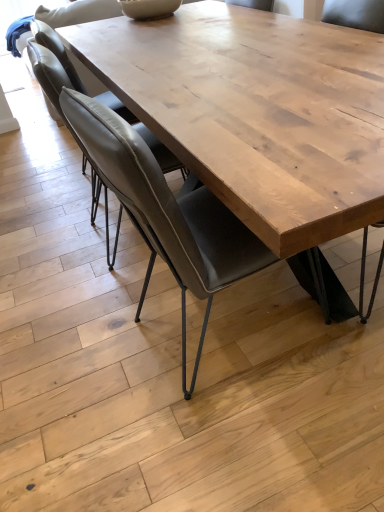
Question: Can you confirm if leather-like gray chair at center, which ranks as the first chair in front-to-back order, is thinner than leather at left, the 2th chair when ordered from front to back?

Choices:
 (A) yes
 (B) no

Answer: (B)

Question: Would you consider leather-like gray chair at center, which ranks as the first chair in front-to-back order, to be distant from leather at left, placed as the first chair when sorted from back to front?

Choices:
 (A) yes
 (B) no

Answer: (B)

Question: Is leather-like gray chair at center, the 2th chair from the back, facing away from leather at left, placed as the first chair when sorted from back to front?

Choices:
 (A) no
 (B) yes

Answer: (A)

Question: Can you confirm if leather-like gray chair at center, which ranks as the first chair in front-to-back order, is shorter than leather at left, placed as the first chair when sorted from back to front?

Choices:
 (A) yes
 (B) no

Answer: (B)

Question: From a real-world perspective, is leather-like gray chair at center, which ranks as the first chair in front-to-back order, physically below leather at left, the 2th chair when ordered from front to back?

Choices:
 (A) yes
 (B) no

Answer: (A)

Question: Is leather at left, the 2th chair when ordered from front to back, completely or partially inside leather-like gray chair at center, the 2th chair from the back?

Choices:
 (A) no
 (B) yes

Answer: (A)

Question: Does leather at left, the 2th chair when ordered from front to back, have a lesser width compared to leather-like gray chair at center, the 2th chair from the back?

Choices:
 (A) yes
 (B) no

Answer: (A)

Question: Is the position of leather at left, the 2th chair when ordered from front to back, more distant than that of leather-like gray chair at center, which ranks as the first chair in front-to-back order?

Choices:
 (A) yes
 (B) no

Answer: (A)

Question: Considering the relative sizes of leather at left, the 2th chair when ordered from front to back, and leather-like gray chair at center, which ranks as the first chair in front-to-back order, in the image provided, is leather at left, the 2th chair when ordered from front to back, wider than leather-like gray chair at center, which ranks as the first chair in front-to-back order,?

Choices:
 (A) yes
 (B) no

Answer: (B)

Question: Is leather at left, placed as the first chair when sorted from back to front, at the left side of leather-like gray chair at center, which ranks as the first chair in front-to-back order?

Choices:
 (A) yes
 (B) no

Answer: (A)

Question: Does leather at left, placed as the first chair when sorted from back to front, have a greater height compared to leather-like gray chair at center, which ranks as the first chair in front-to-back order?

Choices:
 (A) no
 (B) yes

Answer: (A)

Question: Is leather at left, placed as the first chair when sorted from back to front, with leather-like gray chair at center, which ranks as the first chair in front-to-back order?

Choices:
 (A) no
 (B) yes

Answer: (A)

Question: Is point (203, 288) closer or farther from the camera than point (51, 101)?

Choices:
 (A) closer
 (B) farther

Answer: (A)